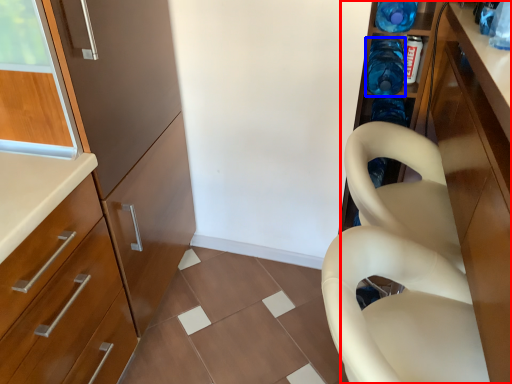
Question: Which of the following is the closest to the observer, cabinetry (highlighted by a red box) or bottle (highlighted by a blue box)?

Choices:
 (A) cabinetry
 (B) bottle

Answer: (A)